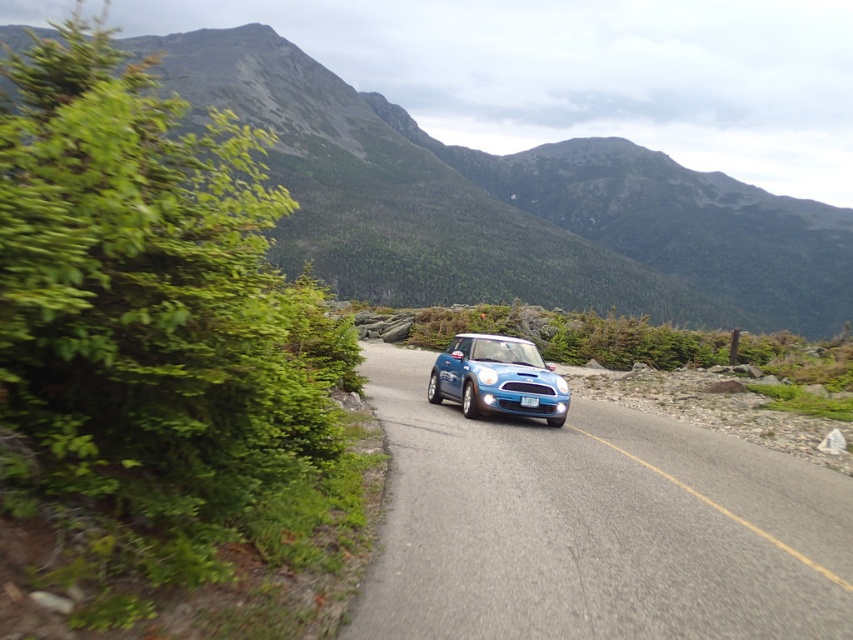
You are a photographer positioned at the camera location. You want to take a photo of both point (482, 365) and point (532, 400) in the scene. Which point should you focus on first to ensure both are in focus?

You should focus on point (482, 365) first because it is closer to the camera than point (532, 400). By focusing on the closer point, the depth of field may include the farther point as well, ensuring both are in focus.

You are a driver approaching the matte blue car at center and the blue plastic license plate at center on the mountain road. Which object is closer to you as you drive forward?

The matte blue car at center is positioned over the blue plastic license plate at center, so the matte blue car at center is closer to you as you drive forward.